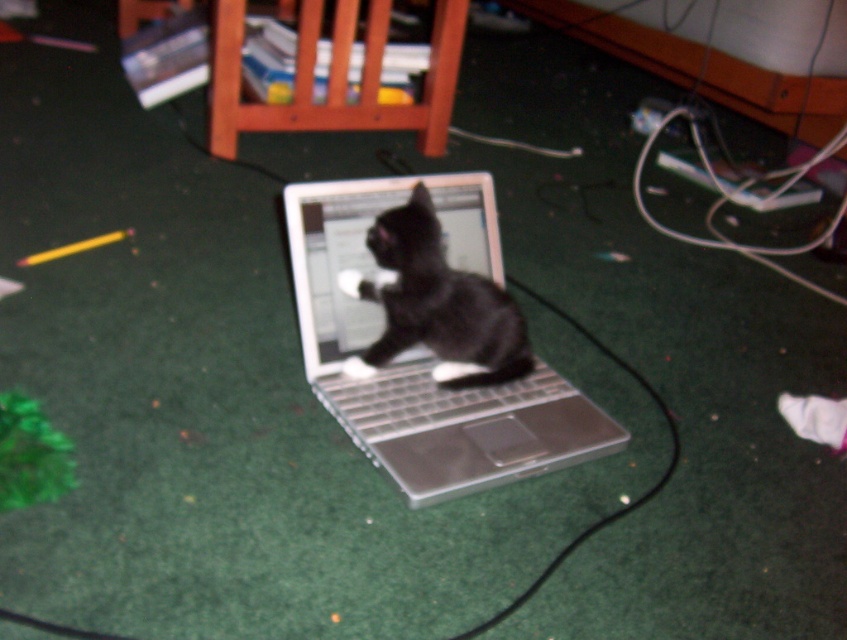
Based on the photo, does silver metallic laptop at center have a larger size compared to silver metallic keyboard at center?

Correct, silver metallic laptop at center is larger in size than silver metallic keyboard at center.

Can you confirm if silver metallic laptop at center is positioned below silver metallic keyboard at center?

Incorrect, silver metallic laptop at center is not positioned below silver metallic keyboard at center.

Identify the location of silver metallic laptop at center. pyautogui.click(x=419, y=369).

Does silver metallic laptop at center appear on the left side of black matte fur cat at center?

In fact, silver metallic laptop at center is to the right of black matte fur cat at center.

Describe the element at coordinates (419, 369) in the screenshot. I see `silver metallic laptop at center` at that location.

The width and height of the screenshot is (847, 640). Find the location of `silver metallic laptop at center`. silver metallic laptop at center is located at coordinates (419, 369).

The height and width of the screenshot is (640, 847). Identify the location of silver metallic laptop at center. (419, 369).

Which of these two, black matte fur cat at center or silver metallic keyboard at center, stands shorter?

Standing shorter between the two is silver metallic keyboard at center.

Can you confirm if black matte fur cat at center is shorter than silver metallic keyboard at center?

No.

Locate an element on the screen. black matte fur cat at center is located at coordinates (435, 304).

Where is `black matte fur cat at center`? The image size is (847, 640). black matte fur cat at center is located at coordinates (435, 304).